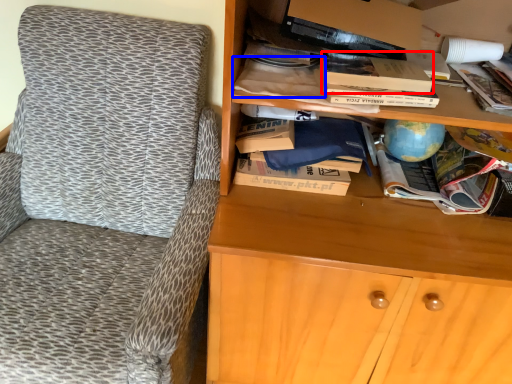
Question: Which point is further to the camera, paperback book (highlighted by a red box) or book (highlighted by a blue box)?

Choices:
 (A) paperback book
 (B) book

Answer: (B)